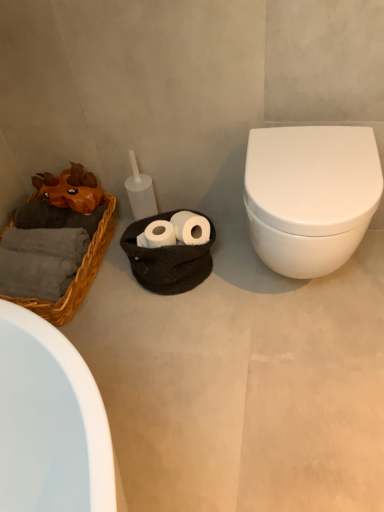
Question: Is orange chiffonier at left surrounded by white matte toilet at right?

Choices:
 (A) no
 (B) yes

Answer: (A)

Question: Does white matte toilet at right have a greater width compared to orange chiffonier at left?

Choices:
 (A) yes
 (B) no

Answer: (A)

Question: Is white matte toilet at right behind orange chiffonier at left?

Choices:
 (A) yes
 (B) no

Answer: (B)

Question: Is white matte toilet at right not near orange chiffonier at left?

Choices:
 (A) yes
 (B) no

Answer: (B)

Question: Does white matte toilet at right have a greater height compared to orange chiffonier at left?

Choices:
 (A) yes
 (B) no

Answer: (B)

Question: From a real-world perspective, is white matte toilet at right over orange chiffonier at left?

Choices:
 (A) no
 (B) yes

Answer: (A)

Question: Is white matte toilet at right looking in the opposite direction of woven wicker basket at left?

Choices:
 (A) no
 (B) yes

Answer: (A)

Question: From the image's perspective, is white matte toilet at right located beneath woven wicker basket at left?

Choices:
 (A) yes
 (B) no

Answer: (A)

Question: Considering the relative sizes of white matte toilet at right and woven wicker basket at left in the image provided, is white matte toilet at right shorter than woven wicker basket at left?

Choices:
 (A) yes
 (B) no

Answer: (A)

Question: Is white matte toilet at right smaller than woven wicker basket at left?

Choices:
 (A) yes
 (B) no

Answer: (B)

Question: Does white matte toilet at right have a lesser width compared to woven wicker basket at left?

Choices:
 (A) yes
 (B) no

Answer: (B)

Question: From the image's perspective, is white matte toilet at right over woven wicker basket at left?

Choices:
 (A) no
 (B) yes

Answer: (A)

Question: Would you say white matte toilet at right contains white glossy toilet at right?

Choices:
 (A) no
 (B) yes

Answer: (A)